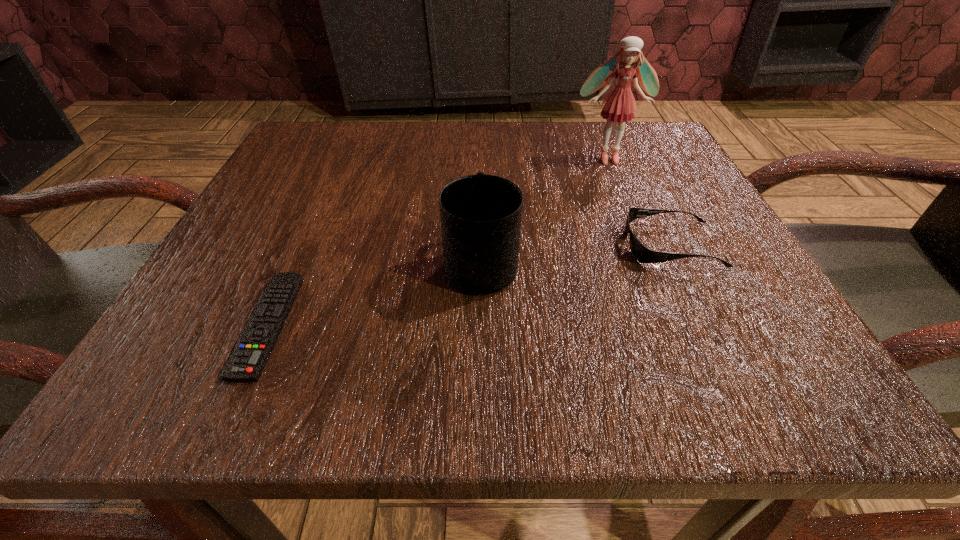
At what (x,y) coordinates should I click in order to perform the action: click on doll. Please return your answer as a coordinate pair (x, y). Looking at the image, I should click on (619, 106).

You are a GUI agent. You are given a task and a screenshot of the screen. Output one action in this format:
    pyautogui.click(x=<x>, y=<y>)
    Task: Click on the farthest object
    The width and height of the screenshot is (960, 540).
    Given the screenshot: What is the action you would take?
    pyautogui.click(x=619, y=106)

Locate an element on the screen. The height and width of the screenshot is (540, 960). the second object from left to right is located at coordinates (480, 214).

At what (x,y) coordinates should I click in order to perform the action: click on mug. Please return your answer as a coordinate pair (x, y). This screenshot has width=960, height=540. Looking at the image, I should click on (480, 214).

At what (x,y) coordinates should I click in order to perform the action: click on the second shortest object. Please return your answer as a coordinate pair (x, y). The height and width of the screenshot is (540, 960). Looking at the image, I should click on (642, 254).

Where is `the leftmost object`? the leftmost object is located at coordinates (246, 363).

This screenshot has height=540, width=960. In order to click on the shortest object in this screenshot , I will do `click(246, 363)`.

This screenshot has width=960, height=540. I want to click on vacant space situated 0.160m on the front-facing side of the farthest object, so point(634,219).

Identify the location of vacant area located on the side of the mug with the handle. Image resolution: width=960 pixels, height=540 pixels. (481, 203).

This screenshot has width=960, height=540. What are the coordinates of `vacant space situated 0.130m on the side of the mug with the handle` in the screenshot? It's located at (481, 186).